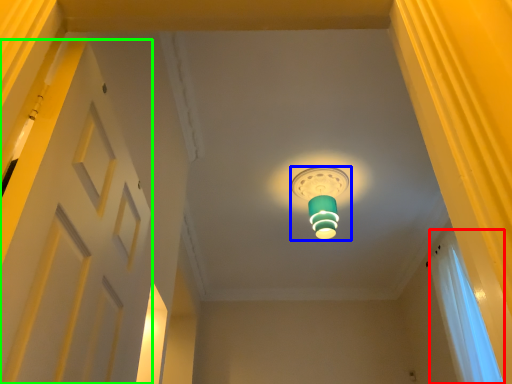
Question: Considering the real-world distances, which object is farthest from curtain (highlighted by a red box)? lamp (highlighted by a blue box) or door (highlighted by a green box)?

Choices:
 (A) lamp
 (B) door

Answer: (B)